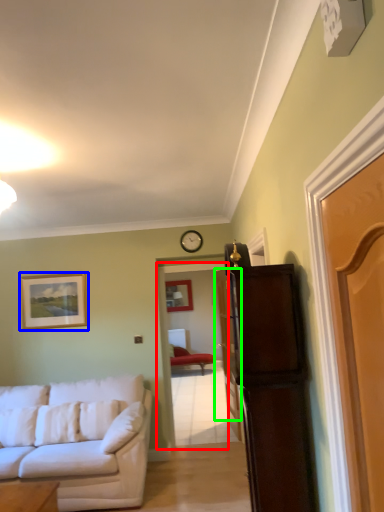
Question: Which object is positioned closest to door (highlighted by a red box)? Select from picture frame (highlighted by a blue box) and door (highlighted by a green box).

Choices:
 (A) picture frame
 (B) door

Answer: (B)